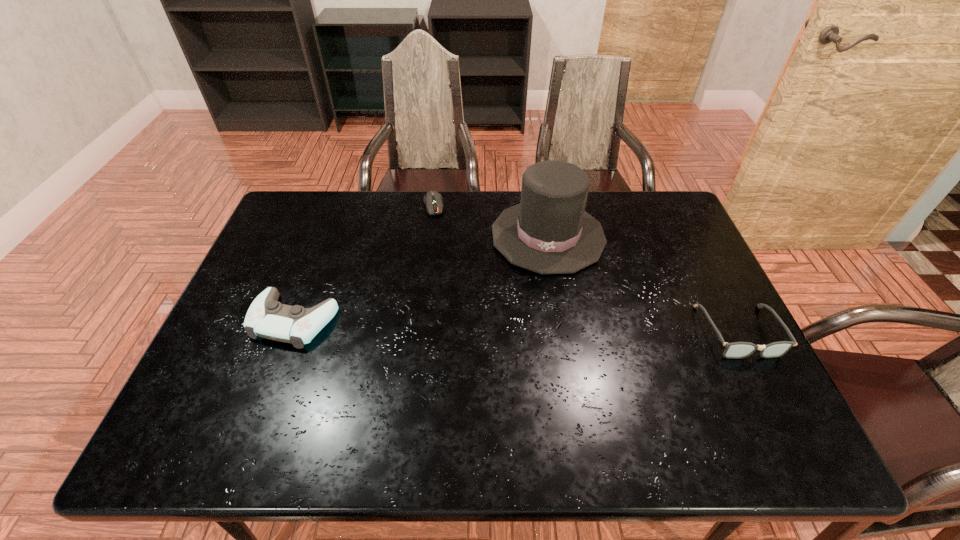
Identify the location of control. (266, 317).

At what (x,y) coordinates should I click in order to perform the action: click on the rightmost object. Please return your answer as a coordinate pair (x, y). Image resolution: width=960 pixels, height=540 pixels. Looking at the image, I should click on (736, 350).

Locate an element on the screen. The height and width of the screenshot is (540, 960). the second object from right to left is located at coordinates (549, 232).

You are a GUI agent. You are given a task and a screenshot of the screen. Output one action in this format:
    pyautogui.click(x=<x>, y=<y>)
    Task: Click on the dress hat
    
    Given the screenshot: What is the action you would take?
    pyautogui.click(x=549, y=232)

Where is `the third object from right to left`? This screenshot has width=960, height=540. the third object from right to left is located at coordinates (433, 200).

Identify the location of computer equipment. (433, 200).

Locate an element on the screen. vacant region located 0.190m on the right of the control is located at coordinates pyautogui.click(x=408, y=320).

Where is `free location located on the face of the rightmost object`? free location located on the face of the rightmost object is located at coordinates (764, 382).

This screenshot has width=960, height=540. I want to click on free space located on the front of the tallest object with the decoration, so click(x=521, y=394).

Where is `vacant area located 0.240m on the front of the tallest object with the decoration`? The height and width of the screenshot is (540, 960). vacant area located 0.240m on the front of the tallest object with the decoration is located at coordinates (530, 342).